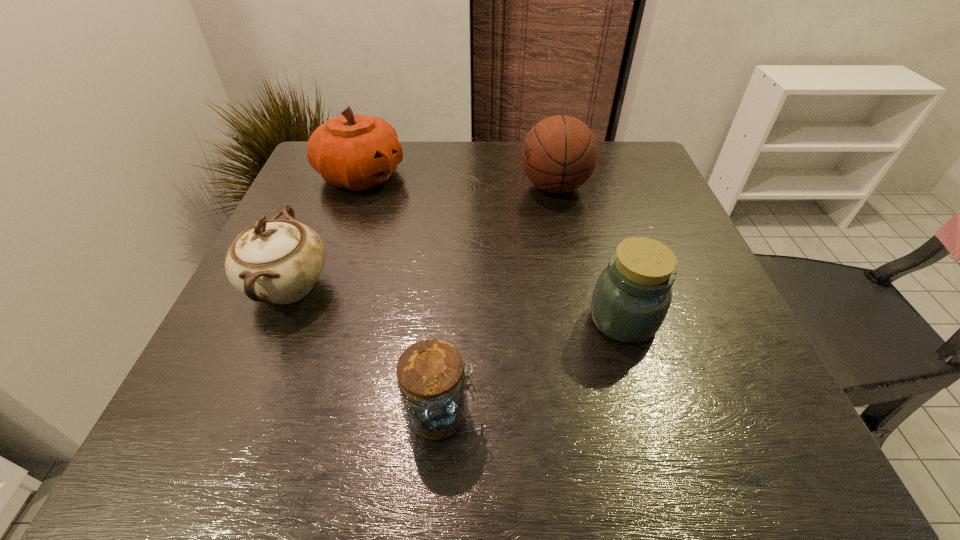
What are the coordinates of `object that is at the far left corner` in the screenshot? It's located at (353, 151).

Locate an element on the screen. The height and width of the screenshot is (540, 960). free space at the far edge of the desktop is located at coordinates (419, 151).

What are the coordinates of `blank area at the near edge` in the screenshot? It's located at (504, 467).

The image size is (960, 540). In the image, there is a desktop. In order to click on vacant space at the left edge in this screenshot , I will do `click(264, 316)`.

The width and height of the screenshot is (960, 540). What are the coordinates of `vacant space at the right edge` in the screenshot? It's located at (725, 323).

Identify the location of free spot at the near left corner of the desktop. This screenshot has width=960, height=540. (184, 447).

Find the location of a particular element. This screenshot has width=960, height=540. vacant space at the far right corner of the desktop is located at coordinates (617, 149).

Locate an element on the screen. The image size is (960, 540). vacant space that is in between the basketball and the right jar is located at coordinates (589, 253).

Locate an element on the screen. The image size is (960, 540). vacant space that is in between the basketball and the farther jar is located at coordinates pyautogui.click(x=589, y=253).

The image size is (960, 540). In order to click on vacant area between the right jar and the nearest object in this screenshot , I will do `click(532, 367)`.